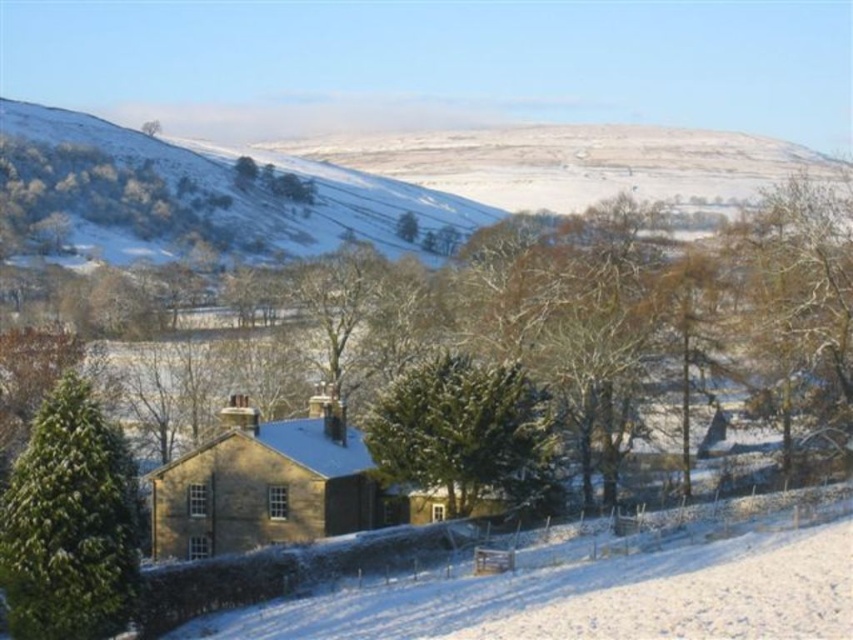
Consider the image. You are a delivery drone with a maximum flight range of 150 feet. You need to deliver a package from the snowy grassland at upper left to the green textured evergreen at center. Can you complete the delivery without recharging?

The snowy grassland at upper left and green textured evergreen at center are 159.41 feet apart from each other. Since the distance exceeds the drone maximum flight range of 150 feet, the drone cannot complete the delivery without recharging.